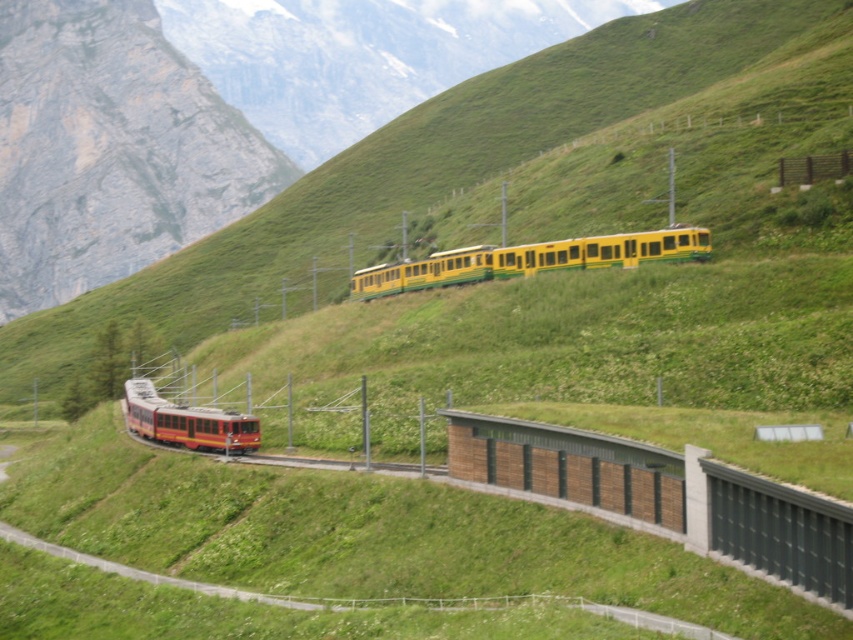
Is yellow matte train at center taller than matte red train at lower left?

Correct, yellow matte train at center is much taller as matte red train at lower left.

What do you see at coordinates (531, 259) in the screenshot? The height and width of the screenshot is (640, 853). I see `yellow matte train at center` at bounding box center [531, 259].

At what (x,y) coordinates should I click in order to perform the action: click on yellow matte train at center. Please return your answer as a coordinate pair (x, y). Looking at the image, I should click on (531, 259).